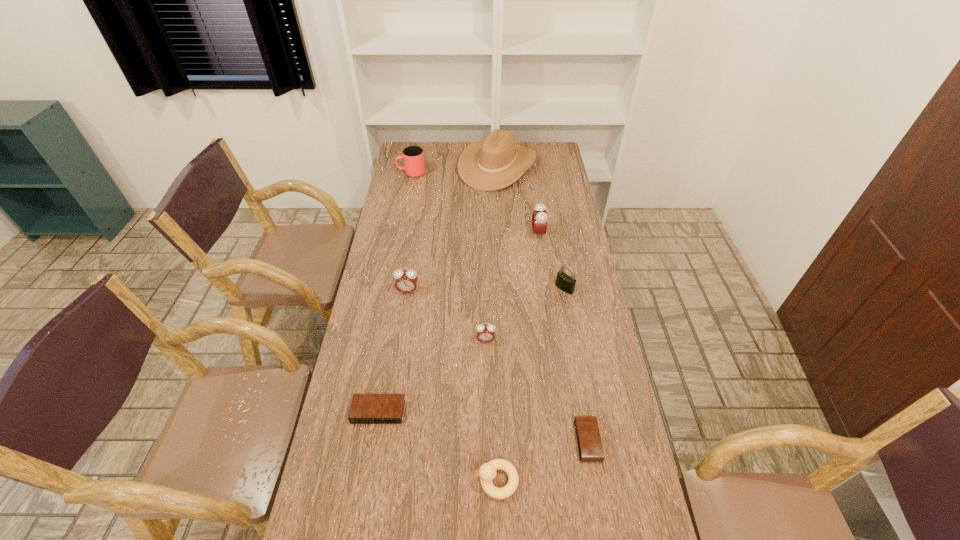
The width and height of the screenshot is (960, 540). In order to click on brown cowboy hat in this screenshot , I will do coord(489,164).

Image resolution: width=960 pixels, height=540 pixels. Identify the location of the farthest alarm clock. (539, 216).

You are a GUI agent. You are given a task and a screenshot of the screen. Output one action in this format:
    pyautogui.click(x=<x>, y=<y>)
    Task: Click on the tallest alarm clock
    The height and width of the screenshot is (540, 960).
    Given the screenshot: What is the action you would take?
    pyautogui.click(x=539, y=216)

Identify the location of cup. The height and width of the screenshot is (540, 960). (413, 157).

I want to click on the second farthest alarm clock, so click(406, 281).

The height and width of the screenshot is (540, 960). Find the location of `the second smallest pink alarm clock`. the second smallest pink alarm clock is located at coordinates (406, 281).

You are a GUI agent. You are given a task and a screenshot of the screen. Output one action in this format:
    pyautogui.click(x=<x>, y=<y>)
    Task: Click on the black padlock
    
    Given the screenshot: What is the action you would take?
    pyautogui.click(x=566, y=283)

Image resolution: width=960 pixels, height=540 pixels. Find the location of `the smallest pink alarm clock`. the smallest pink alarm clock is located at coordinates (485, 333).

At what (x,y) coordinates should I click in order to perform the action: click on the nearest pink alarm clock. Please return your answer as a coordinate pair (x, y). Image resolution: width=960 pixels, height=540 pixels. Looking at the image, I should click on (485, 333).

Find the location of a particular element. duckling is located at coordinates [x=487, y=472].